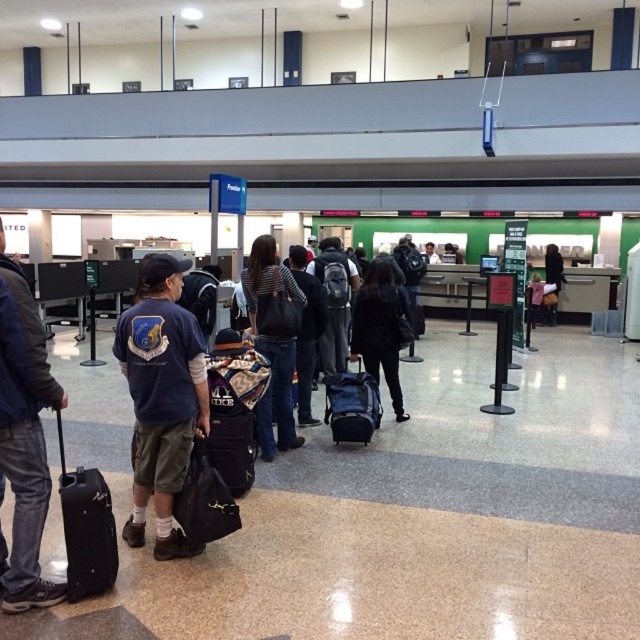
Consider the image. Between striped fabric shirt at center and black matte backpack at center, which one has more height?

striped fabric shirt at center

You are a GUI agent. You are given a task and a screenshot of the screen. Output one action in this format:
    pyautogui.click(x=<x>, y=<y>)
    Task: Click on the striped fabric shirt at center
    This screenshot has height=640, width=640.
    Given the screenshot: What is the action you would take?
    pyautogui.click(x=273, y=340)

Does point (256, 314) come farther from viewer compared to point (371, 348)?

No, it is in front of (371, 348).

The image size is (640, 640). What are the coordinates of `striped fabric shirt at center` in the screenshot? It's located at (273, 340).

Looking at this image, is navy blue shirt at center shorter than black matte suitcase at lower left?

No, navy blue shirt at center is not shorter than black matte suitcase at lower left.

Can you confirm if navy blue shirt at center is positioned to the left of black matte suitcase at lower left?

No, navy blue shirt at center is not to the left of black matte suitcase at lower left.

Where is `navy blue shirt at center`? navy blue shirt at center is located at coordinates (161, 397).

Which of these two, navy blue shirt at center or dark blue denim jacket at left, stands taller?

Standing taller between the two is dark blue denim jacket at left.

Between navy blue shirt at center and dark blue denim jacket at left, which one appears on the right side from the viewer's perspective?

Positioned to the right is navy blue shirt at center.

Is point (164, 356) positioned behind point (28, 499)?

That is True.

The height and width of the screenshot is (640, 640). I want to click on navy blue shirt at center, so pyautogui.click(x=161, y=397).